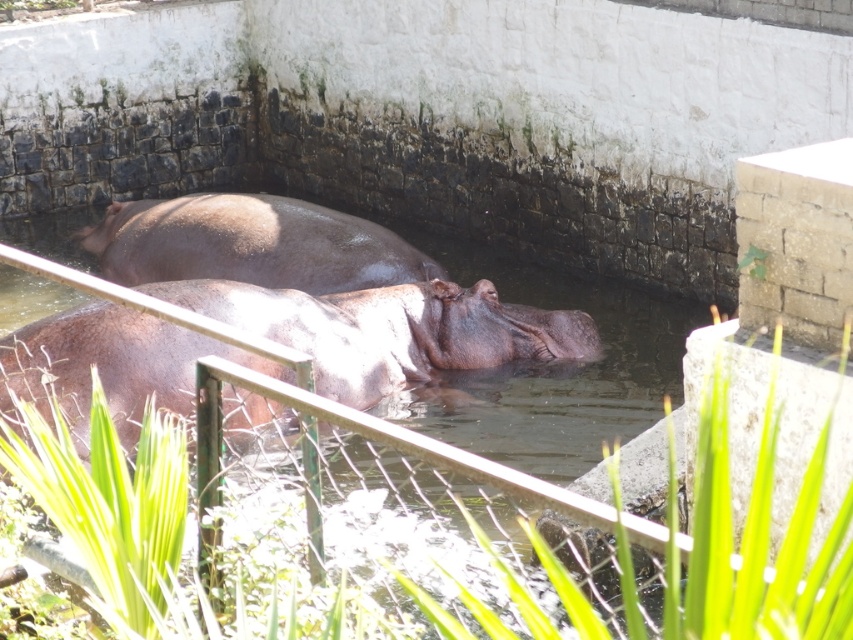
Does brown matte hippo at center appear under brown matte water at center?

Correct, brown matte hippo at center is located below brown matte water at center.

What do you see at coordinates (390, 330) in the screenshot? I see `brown matte hippo at center` at bounding box center [390, 330].

Which is behind, point (573, 333) or point (614, 436)?

Point (573, 333)

You are a GUI agent. You are given a task and a screenshot of the screen. Output one action in this format:
    pyautogui.click(x=<x>, y=<y>)
    Task: Click on the brown matte hippo at center
    The width and height of the screenshot is (853, 640).
    Given the screenshot: What is the action you would take?
    pyautogui.click(x=390, y=330)

Who is positioned more to the right, brown matte water at center or shiny brown hippo at upper center?

brown matte water at center

Does brown matte water at center have a smaller size compared to shiny brown hippo at upper center?

Correct, brown matte water at center occupies less space than shiny brown hippo at upper center.

The height and width of the screenshot is (640, 853). In order to click on brown matte water at center in this screenshot , I will do `click(563, 369)`.

Who is more distant from viewer, (409, 368) or (347, 250)?

The point (347, 250) is more distant.

Who is more distant from viewer, (173, 388) or (361, 250)?

Point (361, 250)

Locate an element on the screen. This screenshot has height=640, width=853. brown matte hippo at center is located at coordinates (390, 330).